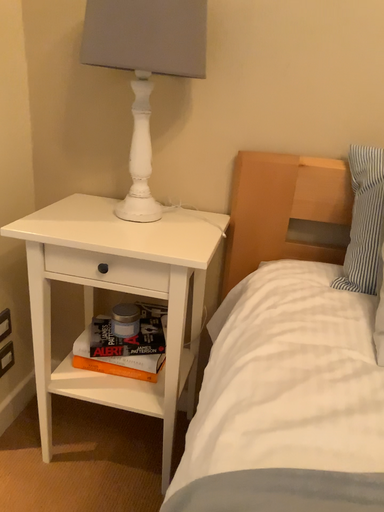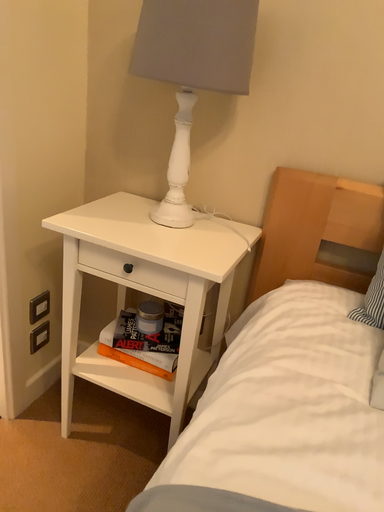
Question: Which way did the camera rotate in the video?

Choices:
 (A) rotated left
 (B) rotated right

Answer: (A)